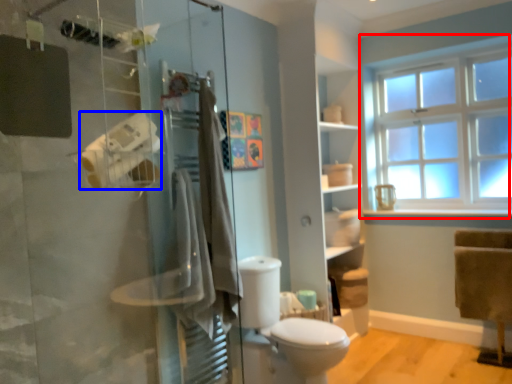
Question: Which object appears farthest to the camera in this image, window (highlighted by a red box) or toilet paper (highlighted by a blue box)?

Choices:
 (A) window
 (B) toilet paper

Answer: (A)